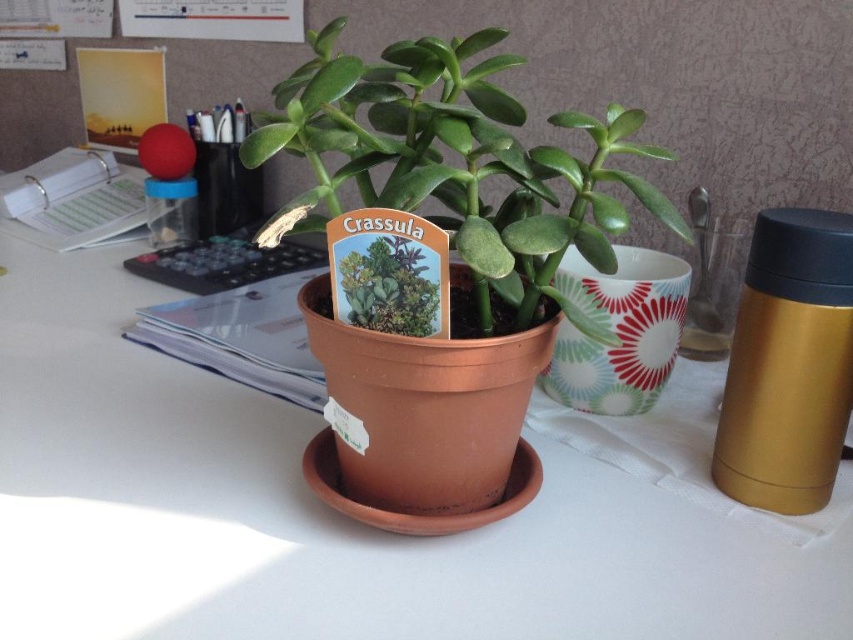
You are organizing a desk and need to place a new item between the matte brown pot at center and the matte clay pot at center. However, you notice something about their arrangement. What is the issue with placing an item between them?

The matte brown pot at center is positioned under the matte clay pot at center, meaning they are stacked vertically rather than placed side by side. Therefore, there is no space between them to place an item.

You are organizing a desk and have two pots, the matte brown pot at center and the matte clay pot at center. Which pot would you choose if you need to place a larger plant that requires more space?

The matte brown pot at center is bigger than the matte clay pot at center, so you should choose the matte brown pot at center for the larger plant that requires more space.

You are standing at the origin point of the coordinate system. You want to place a new object at the position of matte brown pot at center. What are the coordinates you should aim for?

The coordinates for the position of matte brown pot at center are 0.802 in the x direction and 0.377 in the y direction.